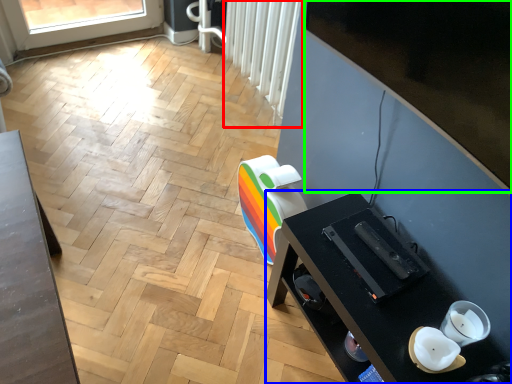
Question: Estimate the real-world distances between objects in this image. Which object is farther from radiator (highlighted by a red box), desk (highlighted by a blue box) or window screen (highlighted by a green box)?

Choices:
 (A) desk
 (B) window screen

Answer: (A)